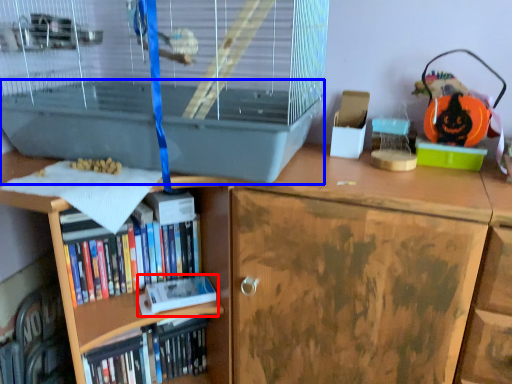
Question: Which point is closer to the camera, paperback book (highlighted by a red box) or wide (highlighted by a blue box)?

Choices:
 (A) paperback book
 (B) wide

Answer: (B)